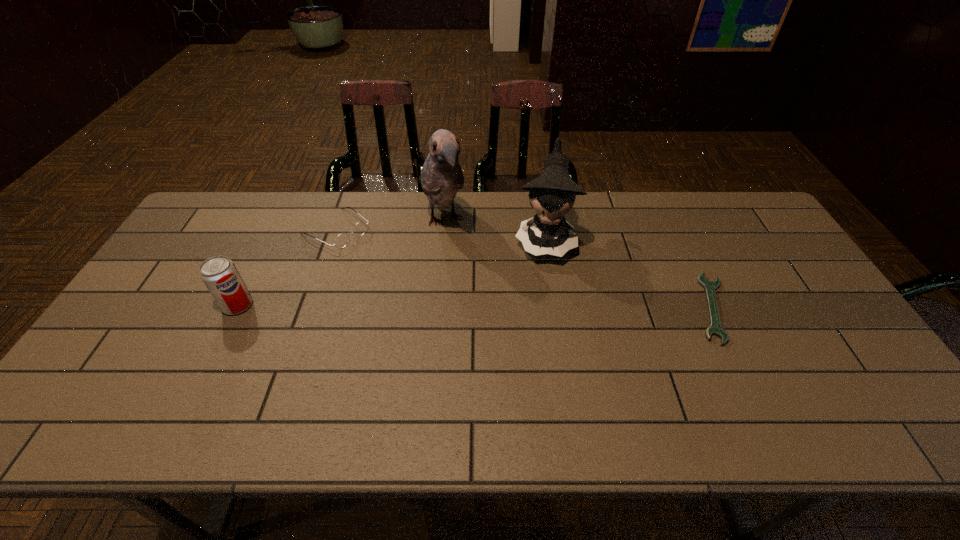
Where is `vacant area situated 0.390m on the back of the leftmost object`? This screenshot has height=540, width=960. vacant area situated 0.390m on the back of the leftmost object is located at coordinates (286, 209).

The height and width of the screenshot is (540, 960). What are the coordinates of `blank space located on the back of the shortest object` in the screenshot? It's located at (689, 260).

Locate an element on the screen. The width and height of the screenshot is (960, 540). vacant region located at the face of the doll is located at coordinates (535, 371).

Image resolution: width=960 pixels, height=540 pixels. I want to click on free point located at the face of the doll, so click(x=538, y=344).

Where is `free space located at the face of the doll`? This screenshot has width=960, height=540. free space located at the face of the doll is located at coordinates (538, 338).

Image resolution: width=960 pixels, height=540 pixels. What are the coordinates of `vacant space situated through the lenses of the second shortest object` in the screenshot? It's located at (392, 265).

Find the location of a particular element. Image resolution: width=960 pixels, height=540 pixels. blank space located 0.320m through the lenses of the second shortest object is located at coordinates (433, 292).

Where is `free space located 0.350m through the lenses of the second shortest object`? The width and height of the screenshot is (960, 540). free space located 0.350m through the lenses of the second shortest object is located at coordinates (441, 297).

Locate an element on the screen. This screenshot has width=960, height=540. blank area located on the front-facing side of the third object from right to left is located at coordinates (458, 271).

You are a GUI agent. You are given a task and a screenshot of the screen. Output one action in this format:
    pyautogui.click(x=<x>, y=<y>)
    Task: Click on the free space located on the front-facing side of the third object from right to left
    The image size is (960, 540).
    Given the screenshot: What is the action you would take?
    pyautogui.click(x=458, y=271)